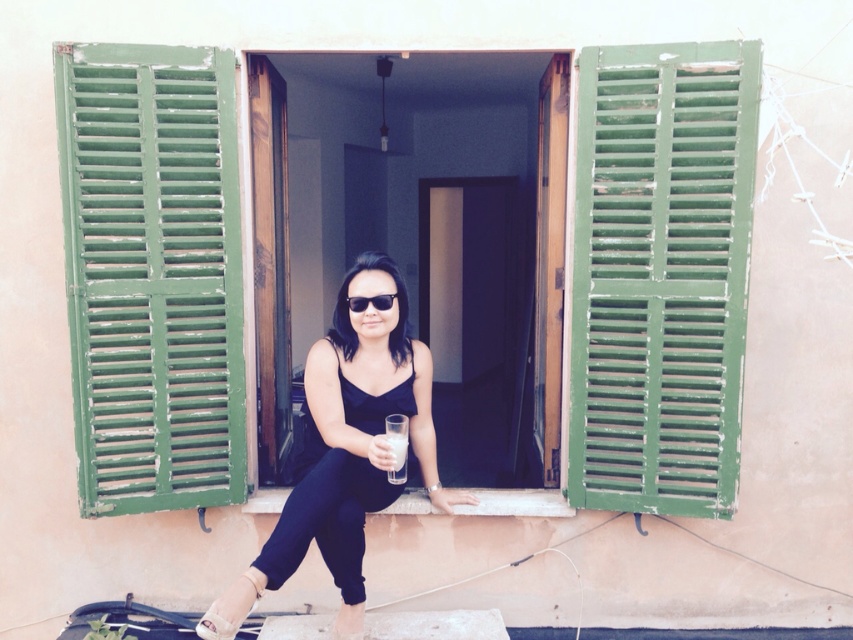
Question: Does green painted wood shutter at right come behind green painted wood shutters at left?

Choices:
 (A) yes
 (B) no

Answer: (B)

Question: Is green painted wood shutters at left bigger than white leather sandal at lower left?

Choices:
 (A) no
 (B) yes

Answer: (B)

Question: Which point appears closest to the camera in this image?

Choices:
 (A) (231, 602)
 (B) (403, 385)
 (C) (614, 429)

Answer: (A)

Question: Which object is positioned farthest from the black plastic sunglasses at center?

Choices:
 (A) green painted wood shutter at right
 (B) green painted wood shutters at left

Answer: (A)

Question: Is green painted wood shutter at right closer to camera compared to translucent glass at center?

Choices:
 (A) no
 (B) yes

Answer: (A)

Question: Estimate the real-world distances between objects in this image. Which object is closer to the matte black dress at center?

Choices:
 (A) green wooden window at center
 (B) white leather sandal at lower left
 (C) translucent glass at center
 (D) green painted wood shutter at right

Answer: (C)